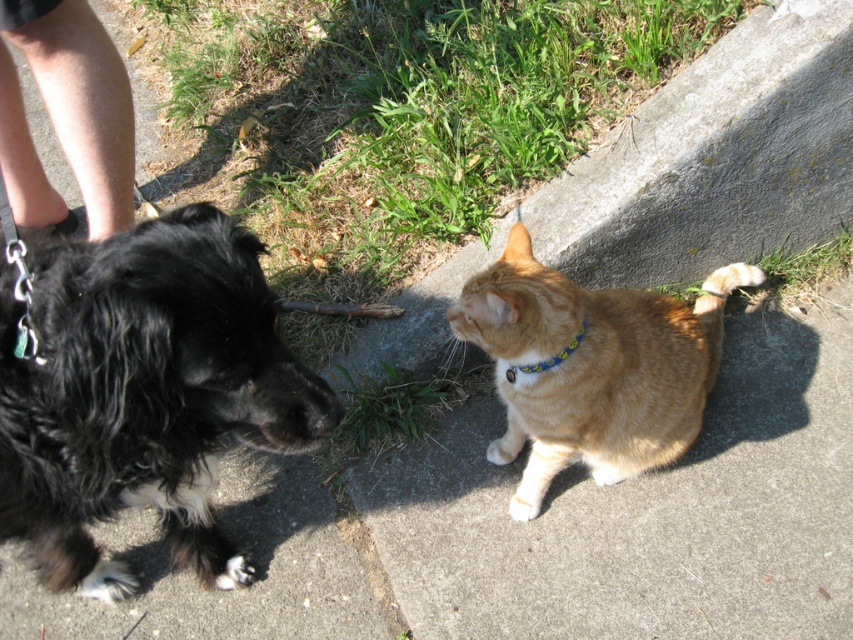
Question: Which point is closer to the camera?

Choices:
 (A) black fluffy dog at left
 (B) orange fur cat at center

Answer: (A)

Question: Can you confirm if black fluffy dog at left is positioned below orange fur cat at center?

Choices:
 (A) yes
 (B) no

Answer: (A)

Question: Based on their relative distances, which object is farther from the blue fabric neckband at center?

Choices:
 (A) orange fur cat at center
 (B) black fluffy dog at left

Answer: (B)

Question: Which of the following is the closest to the observer?

Choices:
 (A) blue fabric neckband at center
 (B) black fluffy dog at left

Answer: (B)

Question: Is orange fur cat at center to the right of blue fabric neckband at center from the viewer's perspective?

Choices:
 (A) yes
 (B) no

Answer: (A)

Question: Is orange fur cat at center positioned in front of blue fabric neckband at center?

Choices:
 (A) no
 (B) yes

Answer: (B)